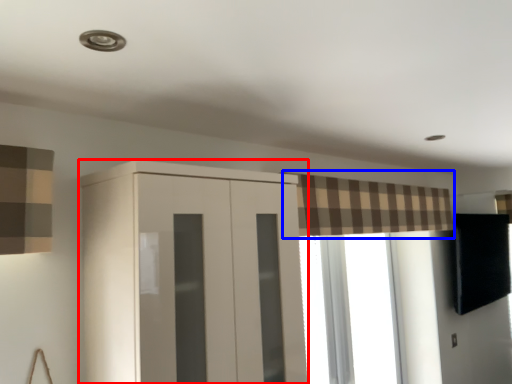
Question: Which object is closer to the camera taking this photo, cupboard (highlighted by a red box) or curtain (highlighted by a blue box)?

Choices:
 (A) cupboard
 (B) curtain

Answer: (A)